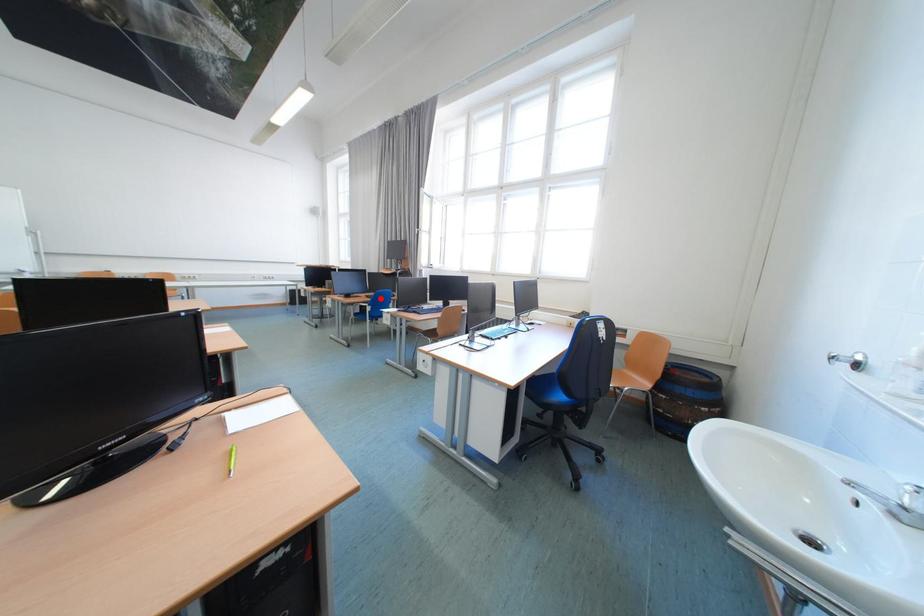
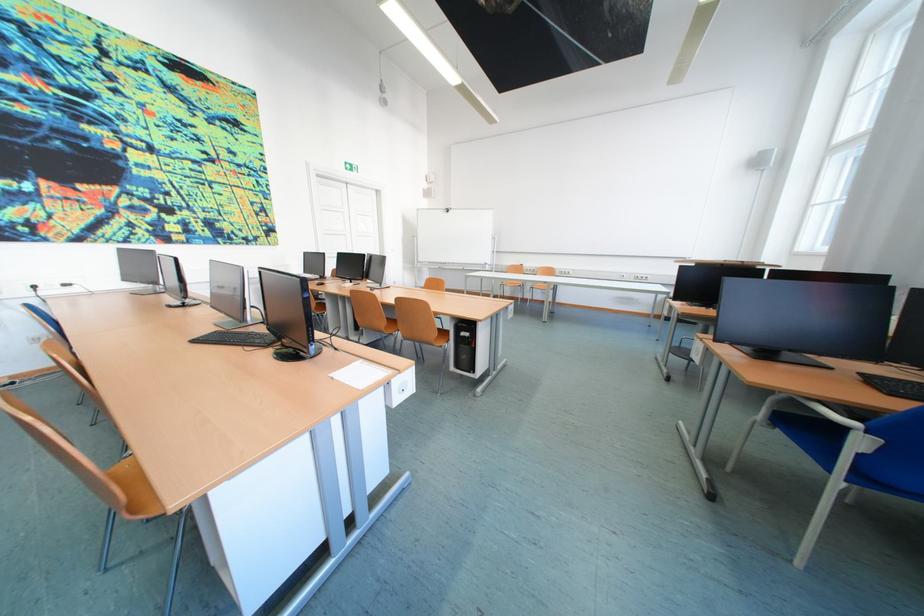
Locate, in the second image, the point that corresponds to the highlighted location in the first image.

(886, 382)